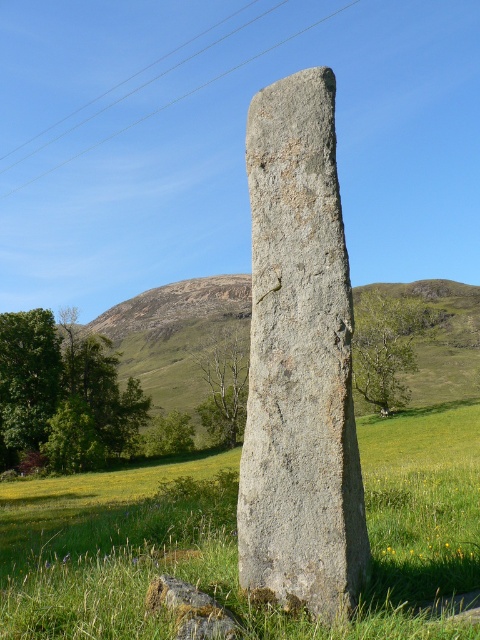
Can you confirm if gray rough stone at center is thinner than green grassy hillside at center?

Correct, gray rough stone at center's width is less than green grassy hillside at center's.

Image resolution: width=480 pixels, height=640 pixels. What are the coordinates of `gray rough stone at center` in the screenshot? It's located at (300, 362).

Is green grassy at center below clear blue sky at upper center?

Correct, green grassy at center is located below clear blue sky at upper center.

Describe the element at coordinates (236, 538) in the screenshot. I see `green grassy at center` at that location.

Who is more forward, (427, 525) or (302, 33)?

Point (427, 525)

This screenshot has height=640, width=480. I want to click on green grassy at center, so click(236, 538).

Can you confirm if gray rough stone at center is positioned below clear blue sky at upper center?

Yes, gray rough stone at center is below clear blue sky at upper center.

Which is in front, point (315, 461) or point (189, 93)?

Positioned in front is point (315, 461).

Find the location of a particular element. Image resolution: width=480 pixels, height=640 pixels. gray rough stone at center is located at coordinates (300, 362).